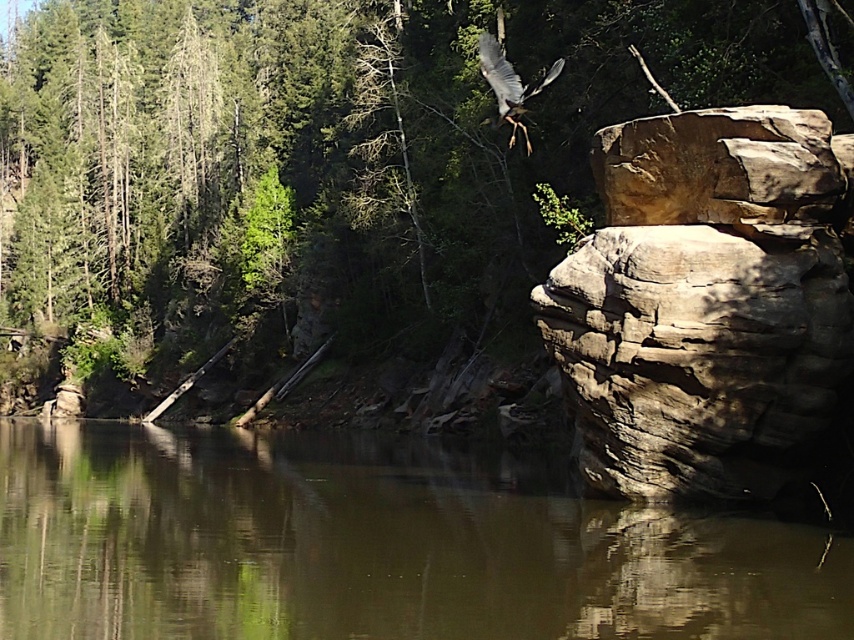
Question: Which object is closer to the camera taking this photo?

Choices:
 (A) brown rough rock at right
 (B) brown smooth water at center
 (C) gray feathered bird at upper center
 (D) green leafy tree at upper center

Answer: (B)

Question: Among these objects, which one is nearest to the camera?

Choices:
 (A) green leafy tree at upper center
 (B) gray feathered bird at upper center
 (C) brown smooth water at center

Answer: (C)

Question: Can you confirm if brown smooth water at center is positioned above gray feathered bird at upper center?

Choices:
 (A) no
 (B) yes

Answer: (A)

Question: Does green leafy tree at upper center have a larger size compared to gray feathered bird at upper center?

Choices:
 (A) yes
 (B) no

Answer: (A)

Question: Does brown smooth water at center appear over gray feathered bird at upper center?

Choices:
 (A) yes
 (B) no

Answer: (B)

Question: Estimate the real-world distances between objects in this image. Which object is closer to the green leafy tree at upper center?

Choices:
 (A) brown rough rock at right
 (B) brown smooth water at center
 (C) gray feathered bird at upper center

Answer: (A)